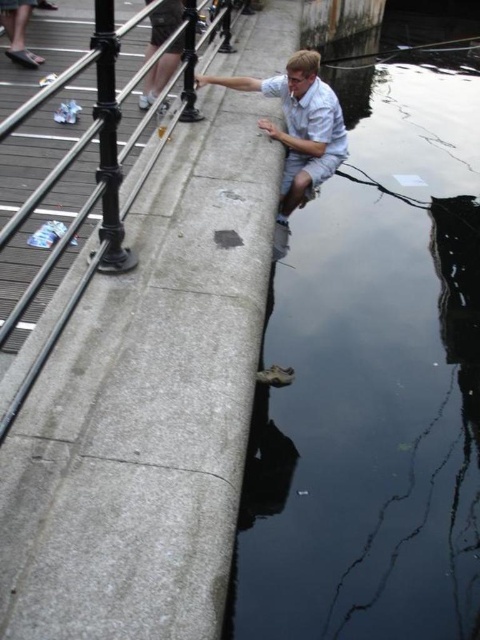
You are standing on the walkway with the metal railing above the concrete wall. You want to get to the transparent glass water at lower right. Which direction should you move to reach it?

The transparent glass water at lower right is located at point 0.594 on the x axis and 0.779 on the y axis. Since lower right is the direction, you should move towards the lower right direction to reach it.

You are standing on the walkway near the metal railing and want to look at the transparent glass water at lower right and the white cotton shirt at center. Which object is nearer to you?

The transparent glass water at lower right is closer to the viewer than the white cotton shirt at center.

You are a painter standing on the walkway and want to paint the transparent glass water at lower right and the polished metal rail at upper center. Which object should you focus on first if you want to paint the larger one?

The transparent glass water at lower right is bigger than the polished metal rail at upper center, so you should focus on painting the transparent glass water at lower right first.